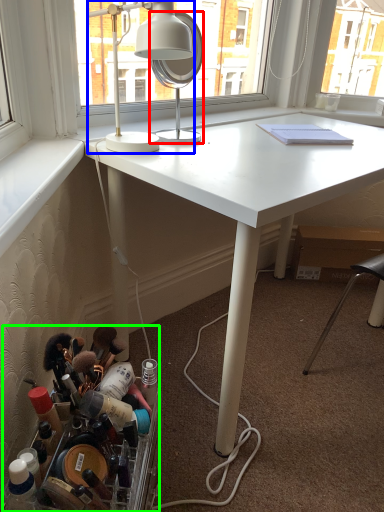
Question: Estimate the real-world distances between objects in this image. Which object is farther from mirror (highlighted by a red box), lamp (highlighted by a blue box) or toiletry (highlighted by a green box)?

Choices:
 (A) lamp
 (B) toiletry

Answer: (B)